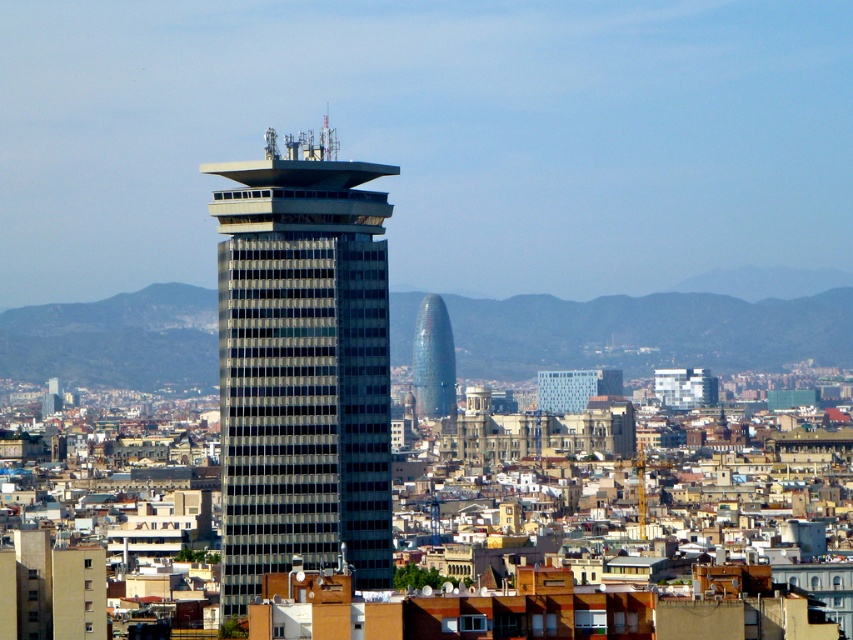
Question: Is matte glass skyscraper at center to the right of blue glass tower at center from the viewer's perspective?

Choices:
 (A) yes
 (B) no

Answer: (B)

Question: Can you confirm if matte glass skyscraper at center is bigger than blue glass tower at center?

Choices:
 (A) no
 (B) yes

Answer: (B)

Question: Among these points, which one is nearest to the camera?

Choices:
 (A) (444, 352)
 (B) (347, 214)

Answer: (A)

Question: Is matte glass skyscraper at center above blue glass tower at center?

Choices:
 (A) no
 (B) yes

Answer: (A)

Question: Which point is farther to the camera?

Choices:
 (A) (426, 362)
 (B) (222, 209)

Answer: (B)